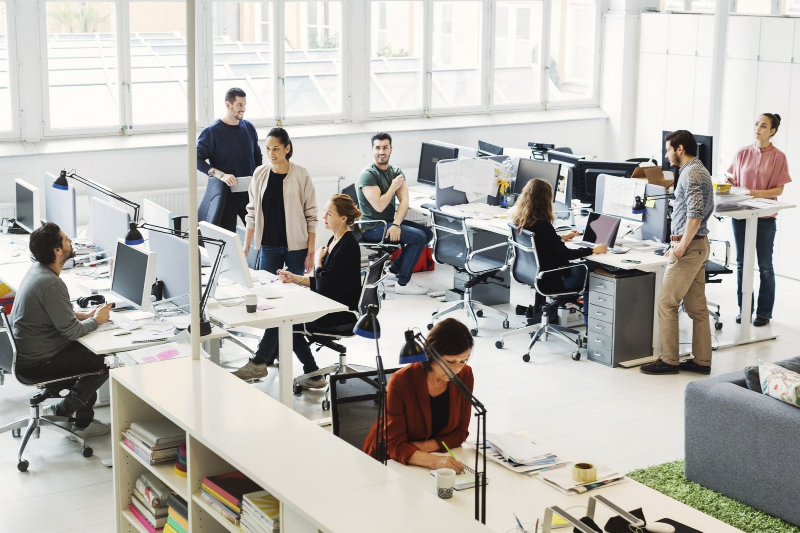
Find the location of a particular element. monitors is located at coordinates (25, 201), (126, 274), (234, 242), (162, 209), (433, 153), (530, 166), (622, 189), (709, 141), (489, 149).